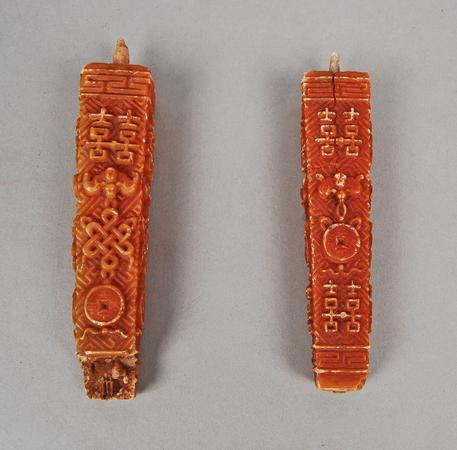
This screenshot has height=450, width=457. In order to click on second patterned orange candle in this screenshot , I will do `click(324, 339)`.